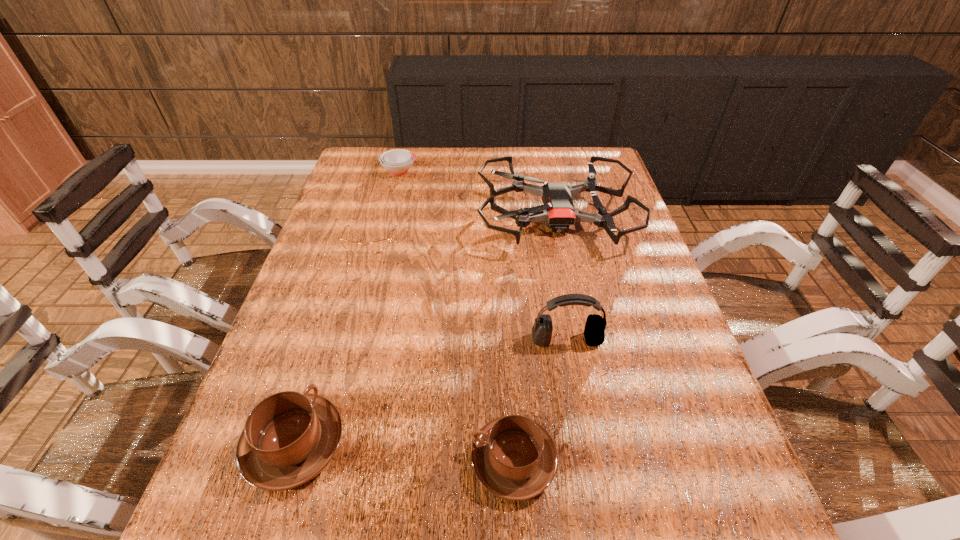
Find the location of a particular element. free space located 0.050m on the headband of the tallest object is located at coordinates (571, 368).

The width and height of the screenshot is (960, 540). What are the coordinates of `soup bowl that is positioned at the far edge` in the screenshot? It's located at (397, 162).

I want to click on drone at the far edge, so click(558, 211).

Where is `cappuccino present at the left edge`? This screenshot has width=960, height=540. cappuccino present at the left edge is located at coordinates (289, 437).

You are a GUI agent. You are given a task and a screenshot of the screen. Output one action in this format:
    pyautogui.click(x=<x>, y=<y>)
    Task: Click on the spectacles that is at the left edge
    
    Given the screenshot: What is the action you would take?
    378,246

The image size is (960, 540). Find the location of `soup bowl that is at the left edge`. soup bowl that is at the left edge is located at coordinates (397, 162).

I want to click on object present at the right edge, so click(558, 211).

Locate an element on the screen. This screenshot has height=540, width=960. object at the far left corner is located at coordinates (397, 162).

The height and width of the screenshot is (540, 960). Identify the location of object present at the near left corner. (289, 437).

Locate an element on the screen. The image size is (960, 540). object present at the far right corner is located at coordinates (558, 211).